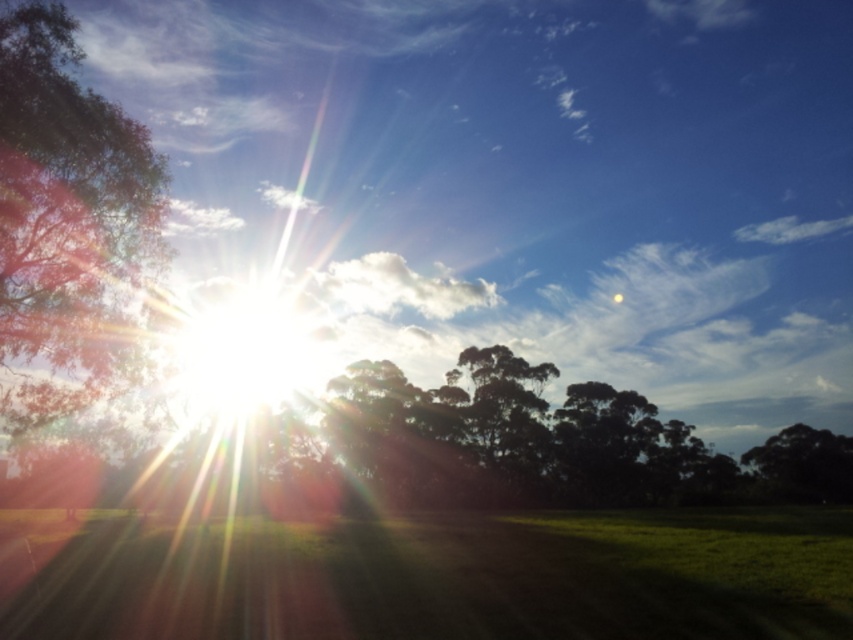
Question: Can you confirm if green leafy tree at left is positioned to the right of green leafy tree at right?

Choices:
 (A) no
 (B) yes

Answer: (A)

Question: Observing the image, what is the correct spatial positioning of green leafy tree at center in reference to green leafy tree at right?

Choices:
 (A) left
 (B) right

Answer: (A)

Question: Estimate the real-world distances between objects in this image. Which object is farther from the green leafy tree at right?

Choices:
 (A) green leafy tree at center
 (B) green leafy tree at left

Answer: (B)

Question: Can you confirm if green leafy tree at left is thinner than green leafy tree at center?

Choices:
 (A) no
 (B) yes

Answer: (B)

Question: Estimate the real-world distances between objects in this image. Which object is farther from the green leafy tree at center?

Choices:
 (A) green leafy tree at right
 (B) green leafy tree at left

Answer: (B)

Question: Which point is closer to the camera?

Choices:
 (A) (488, 452)
 (B) (22, 243)

Answer: (B)